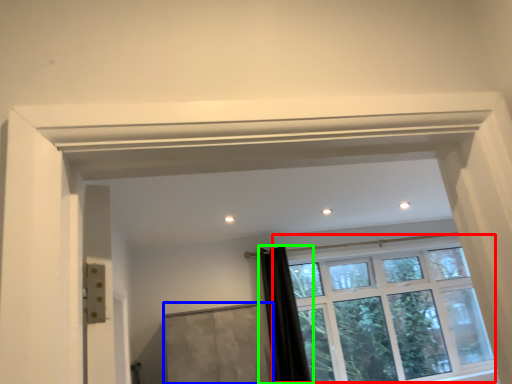
Question: Estimate the real-world distances between objects in this image. Which object is closer to window (highlighted by a red box), screen door (highlighted by a blue box) or shower curtain (highlighted by a green box)?

Choices:
 (A) screen door
 (B) shower curtain

Answer: (B)